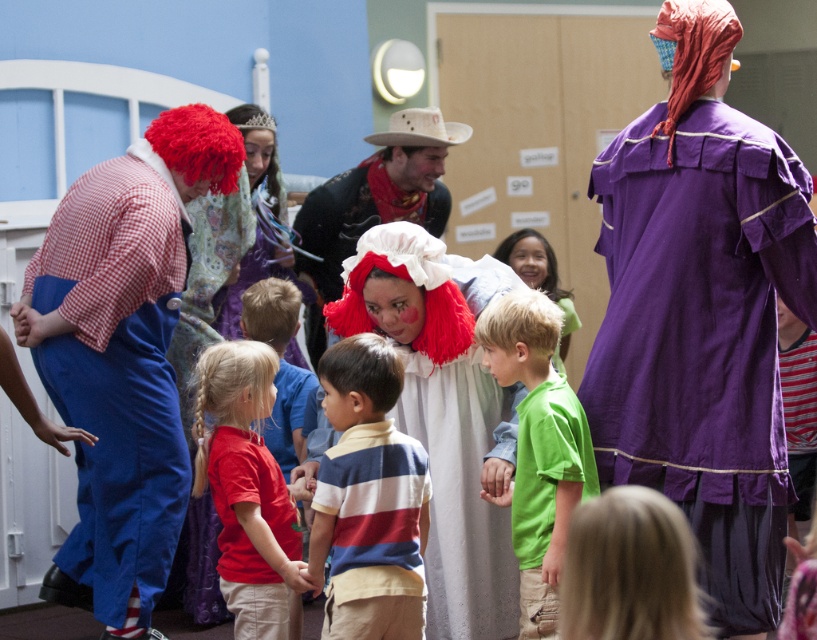
Question: Which of the following is the farthest from the observer?

Choices:
 (A) purple cotton dress at center
 (B) green cotton shirt at center

Answer: (B)

Question: Which object is farther from the camera taking this photo?

Choices:
 (A) white cotton dress at center
 (B) green cotton shirt at center

Answer: (A)

Question: Is white cotton dress at center positioned at the back of red shirt at center?

Choices:
 (A) no
 (B) yes

Answer: (B)

Question: Observing the image, what is the correct spatial positioning of purple cotton dress at center in reference to green cotton shirt at center?

Choices:
 (A) left
 (B) right

Answer: (B)

Question: Which point is farther to the camera?

Choices:
 (A) white cotton dress at center
 (B) green cotton shirt at center
 (C) checkered fabric clown at left
 (D) red cotton shirt at center

Answer: (A)

Question: Can you confirm if purple cotton dress at center is positioned to the left of green cotton shirt at center?

Choices:
 (A) yes
 (B) no

Answer: (B)